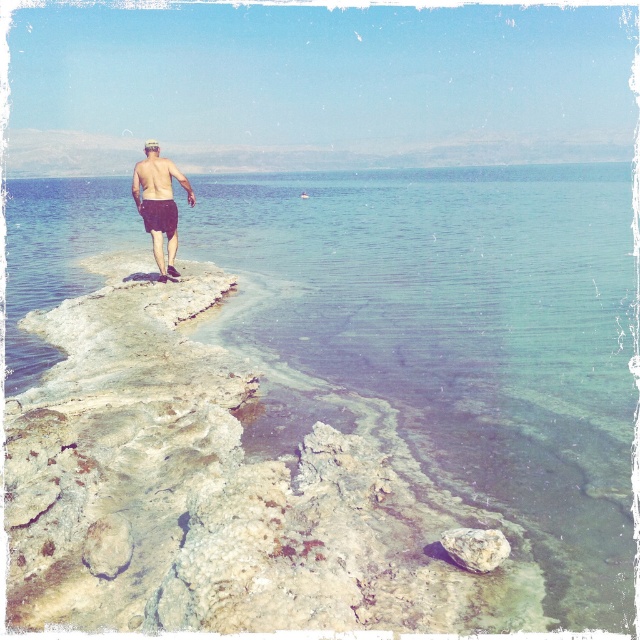
Does clear saltwater at center appear under matte black shorts at center?

No, clear saltwater at center is not below matte black shorts at center.

Can you confirm if clear saltwater at center is taller than matte black shorts at center?

Yes, clear saltwater at center is taller than matte black shorts at center.

Is point (436, 333) positioned behind point (160, 193)?

No, it is in front of (160, 193).

Identify the location of clear saltwater at center. The width and height of the screenshot is (640, 640). (458, 321).

Is smooth gray rock at lower right smaller than black matte shorts at center?

Yes, smooth gray rock at lower right is smaller than black matte shorts at center.

Is smooth gray rock at lower right to the right of black matte shorts at center from the viewer's perspective?

Yes, smooth gray rock at lower right is to the right of black matte shorts at center.

Locate an element on the screen. smooth gray rock at lower right is located at coordinates 476,547.

You are a GUI agent. You are given a task and a screenshot of the screen. Output one action in this format:
    pyautogui.click(x=<x>, y=<y>)
    Task: Click on the smooth gray rock at lower right
    This screenshot has height=640, width=640.
    Given the screenshot: What is the action you would take?
    [x=476, y=547]

Can you confirm if clear saltwater at center is shorter than smooth gray rock at lower right?

Incorrect, clear saltwater at center's height does not fall short of smooth gray rock at lower right's.

Does clear saltwater at center appear on the left side of smooth gray rock at lower right?

Yes, clear saltwater at center is to the left of smooth gray rock at lower right.

Measure the distance between point (141,237) and camera.

The distance of point (141,237) from camera is 20.84 meters.

At what (x,y) coordinates should I click in order to perform the action: click on clear saltwater at center. Please return your answer as a coordinate pair (x, y). The width and height of the screenshot is (640, 640). Looking at the image, I should click on (458, 321).